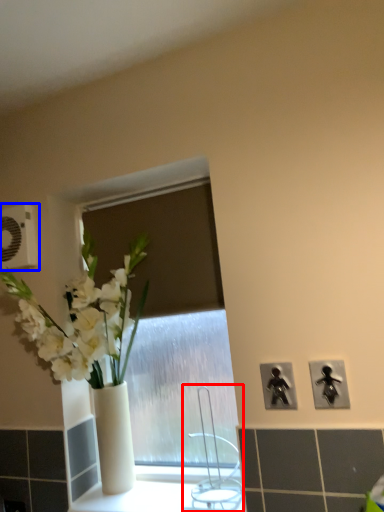
Question: Which object appears farthest to the camera in this image, faucet (highlighted by a red box) or electric outlet (highlighted by a blue box)?

Choices:
 (A) faucet
 (B) electric outlet

Answer: (B)